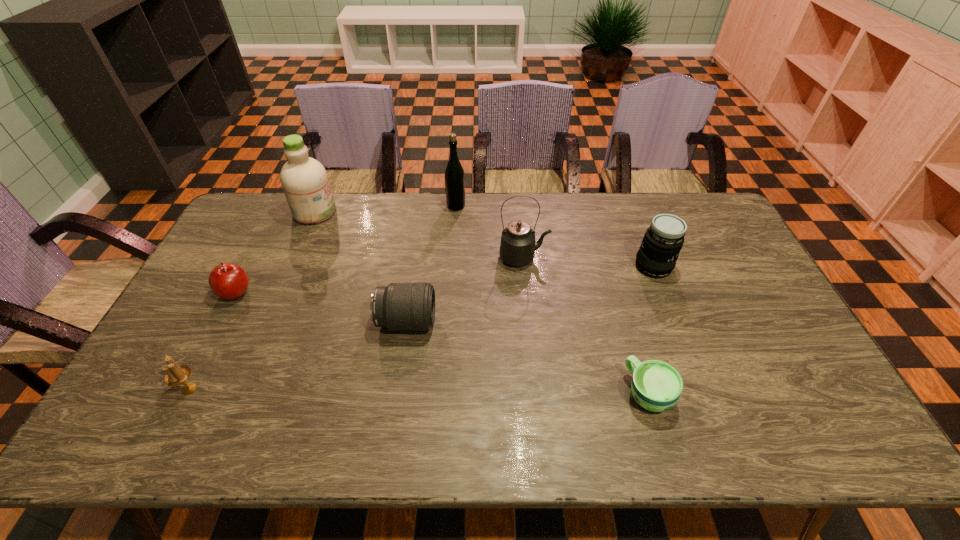
Where is `vacant space at the far right corner of the desktop`? vacant space at the far right corner of the desktop is located at coordinates (714, 212).

In the image, there is a desktop. At what (x,y) coordinates should I click in order to perform the action: click on free space at the near right corner. Please return your answer as a coordinate pair (x, y). This screenshot has height=540, width=960. Looking at the image, I should click on (822, 428).

Find the location of a particular element. The width and height of the screenshot is (960, 540). vacant area that lies between the apple and the cleansing agent is located at coordinates (276, 253).

Locate an element on the screen. empty space between the kettle and the taller telephoto lens is located at coordinates (588, 262).

Image resolution: width=960 pixels, height=540 pixels. Find the location of `free space that is in between the apple and the rightmost object`. free space that is in between the apple and the rightmost object is located at coordinates (444, 280).

This screenshot has height=540, width=960. What are the coordinates of `vacant space in between the candle holder and the apple` in the screenshot? It's located at (212, 341).

Where is `free area in between the fifth shortest object and the sixth object from right to left`? The width and height of the screenshot is (960, 540). free area in between the fifth shortest object and the sixth object from right to left is located at coordinates (484, 239).

Locate an element on the screen. The image size is (960, 540). vacant area that lies between the candle holder and the third object from left to right is located at coordinates (252, 300).

Locate an element on the screen. free space between the shorter telephoto lens and the apple is located at coordinates (321, 307).

Where is `vacant space that's between the fifth object from right to left and the beer bottle`? vacant space that's between the fifth object from right to left and the beer bottle is located at coordinates (431, 264).